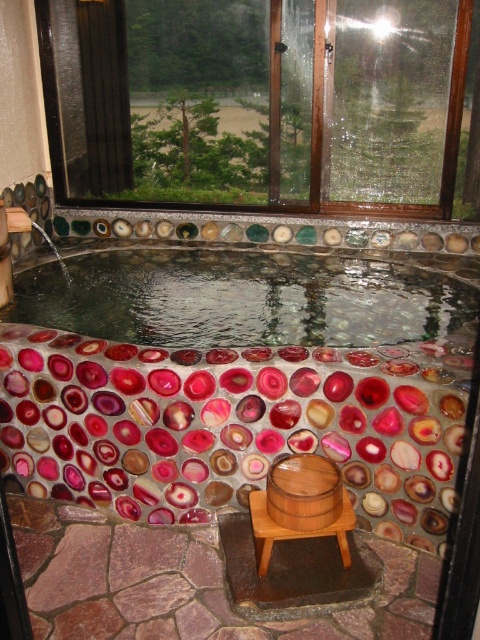
You are standing at the entrance of the onsen and want to reach the wooden at lower center. Which direction should you move relative to the polished stone bath at center?

The wooden at lower center is behind the polished stone bath at center, so you should move backward away from the bath to reach it.